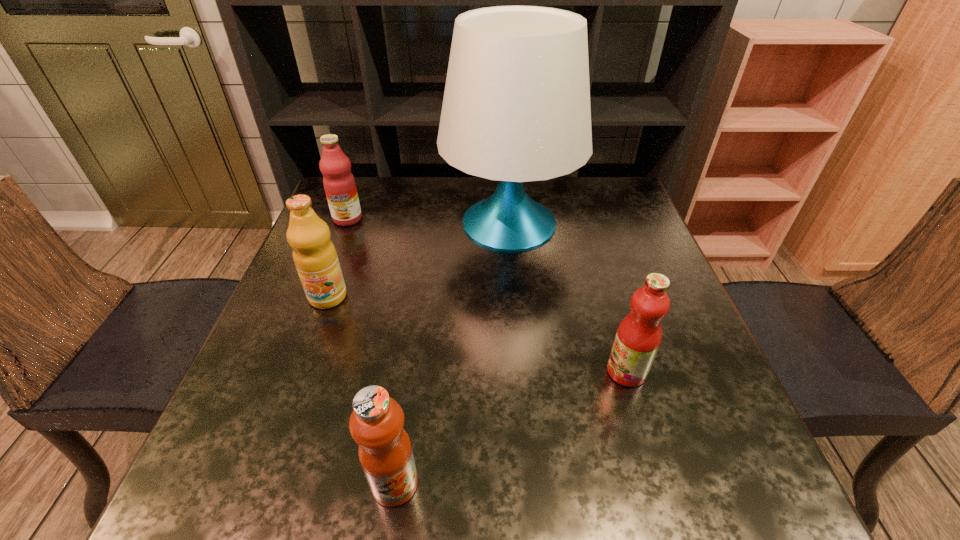
The width and height of the screenshot is (960, 540). I want to click on vacant point at the left edge, so click(x=278, y=322).

Image resolution: width=960 pixels, height=540 pixels. Identify the location of free location at the right edge. (695, 441).

Find the location of a particular element. vacant area at the far left corner of the desktop is located at coordinates [x=362, y=189].

Where is `vacant space at the far right corner of the desktop`? vacant space at the far right corner of the desktop is located at coordinates (579, 187).

Find the location of `vacant space in between the third farthest fruit juice and the nearest fruit juice`. vacant space in between the third farthest fruit juice and the nearest fruit juice is located at coordinates (511, 427).

At what (x,y) coordinates should I click in order to perform the action: click on unoccupied area between the farthest fruit juice and the nearest fruit juice. Please return your answer as a coordinate pair (x, y). Looking at the image, I should click on (372, 351).

Identify the location of vacant space that is in between the tallest object and the farthest fruit juice. (429, 221).

Find the location of a particular element. blank region between the table lamp and the rightmost fruit juice is located at coordinates (568, 297).

You are a GUI agent. You are given a task and a screenshot of the screen. Output one action in this format:
    pyautogui.click(x=<x>, y=<y>)
    Task: Click on the free space that is in between the tallest object and the third nearest object
    The height and width of the screenshot is (540, 960).
    Given the screenshot: What is the action you would take?
    pyautogui.click(x=419, y=260)

Find the location of a particular element. empty space that is in between the table lamp and the nearest object is located at coordinates (452, 353).